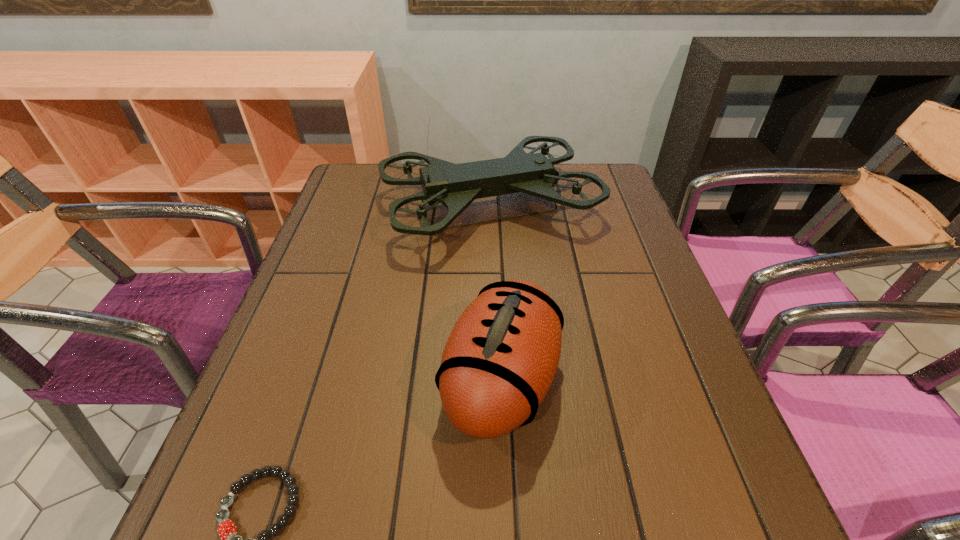
At what (x,y) coordinates should I click in order to perform the action: click on object located at the far right corner. Please return your answer as a coordinate pair (x, y). Looking at the image, I should click on (456, 186).

In the image, there is a desktop. Identify the location of vacant space at the near edge. (357, 533).

Locate an element on the screen. free region at the left edge of the desktop is located at coordinates (307, 280).

Identify the location of blank space at the right edge. This screenshot has width=960, height=540. (633, 330).

Locate an element on the screen. The width and height of the screenshot is (960, 540). free space at the far left corner of the desktop is located at coordinates (394, 176).

Where is `free region at the far right corner of the desktop`? free region at the far right corner of the desktop is located at coordinates (614, 177).

This screenshot has width=960, height=540. In order to click on object that is the second closest to the football (American) in this screenshot , I will do `click(230, 539)`.

Locate an element on the screen. The width and height of the screenshot is (960, 540). object that is the second closest one to the shortest object is located at coordinates (456, 186).

At what (x,y) coordinates should I click in order to perform the action: click on vacant space that satisfies the following two spatial constraints: 1. on the front side of the second tallest object; 2. on the left side of the drone. Please return your answer as a coordinate pair (x, y). Looking at the image, I should click on (493, 381).